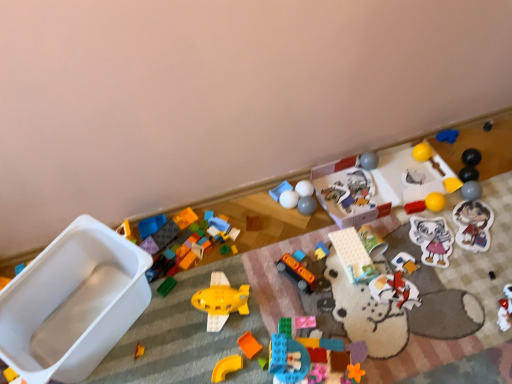
The height and width of the screenshot is (384, 512). I want to click on free point behind translucent plastic blocks at center, arranged as the 11th toy when viewed from the left, so coord(307,309).